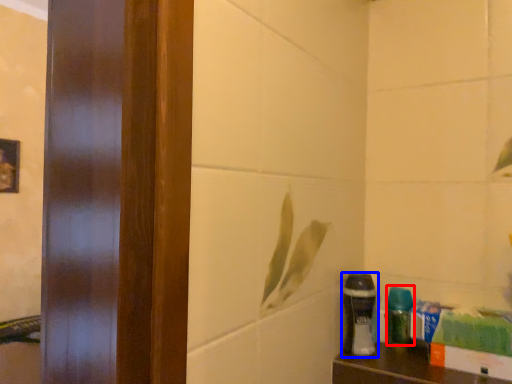
Question: Which of the following is the closest to the observer, cleaning product (highlighted by a red box) or shaving cream (highlighted by a blue box)?

Choices:
 (A) cleaning product
 (B) shaving cream

Answer: (B)